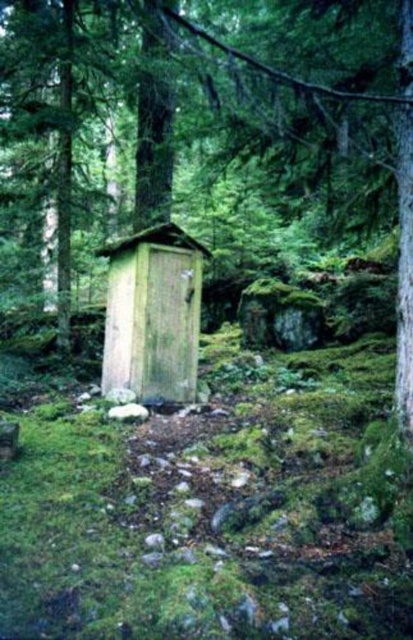
You are a hiker lost in the forest and see the smooth wooden outhouse at center and the wooden hut at center. Which structure is closer to you?

The smooth wooden outhouse at center is closer to you since the wooden hut at center is positioned behind it.

In the scene shown: You are a hiker who wants to take shelter from the rain. You see a smooth wooden outhouse at center and a wooden hut at center. Which one is higher up and can provide better protection from the rain?

The smooth wooden outhouse at center is above the wooden hut at center, so it is higher up and can provide better protection from the rain.

You are a hiker who needs to determine which structure is taller between the smooth wooden outhouse at center and the wooden hut at center. Based on the scene, which one is taller?

The wooden hut at center is taller than the smooth wooden outhouse at center.